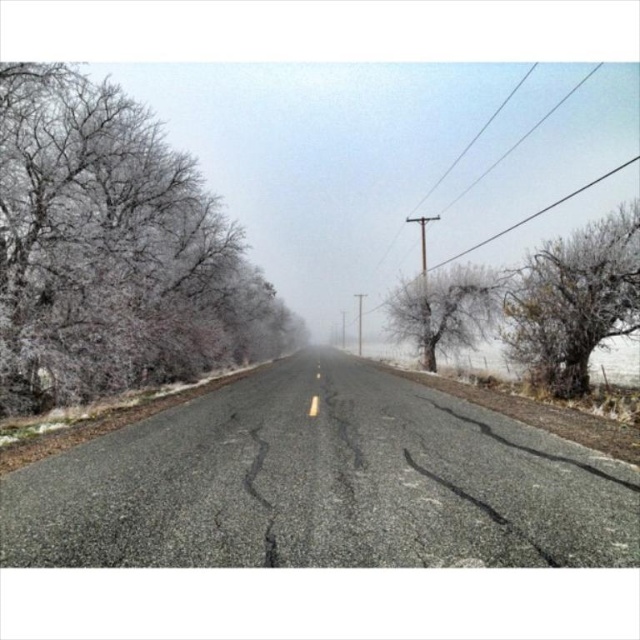
You are driving along the rural road and see the frosted bark tree at right and the frosted ice tree at center. Which tree is closer to the right side of the road?

The frosted bark tree at right is closer to the right side of the road because it is positioned to the right of the frosted ice tree at center.

You are standing at the center of the road and looking forward. Which direction should you turn to face the frosted branches at left?

The frosted branches at left are located at 2D coordinates point (113, 250), which is to the left side of the road. Therefore, you should turn to your left to face the frosted branches at left.

You are driving along the rural road and see the frosted branches at left and the frosted bark tree at right. Which object is located to the left of the other?

The frosted branches at left is positioned on the left side of frosted bark tree at right.